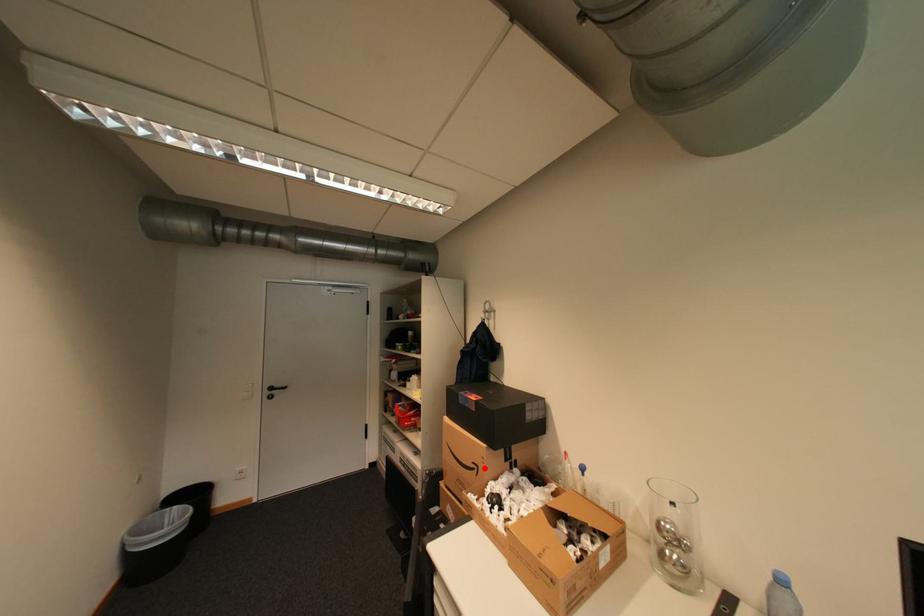
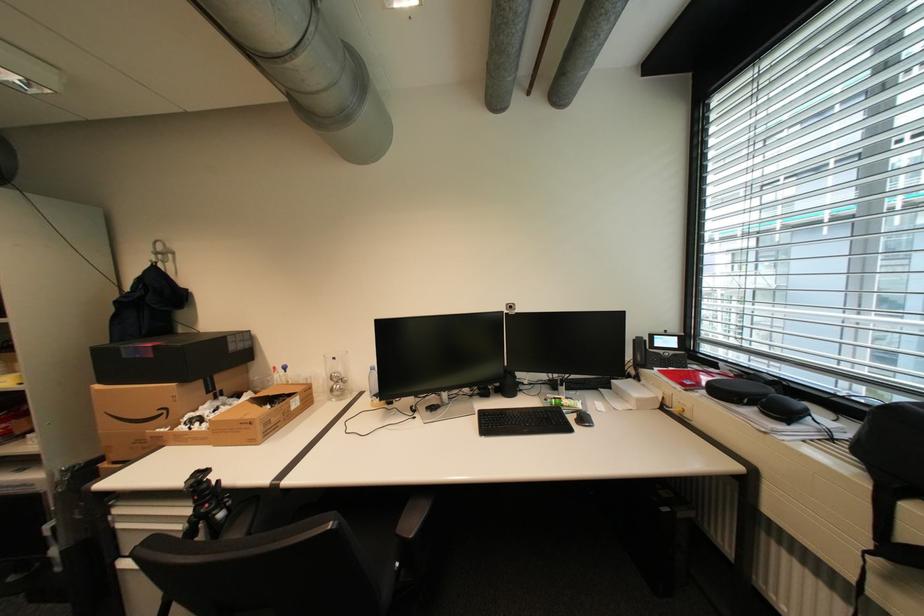
In the second image, find the point that corresponds to the highlighted location in the first image.

(174, 411)